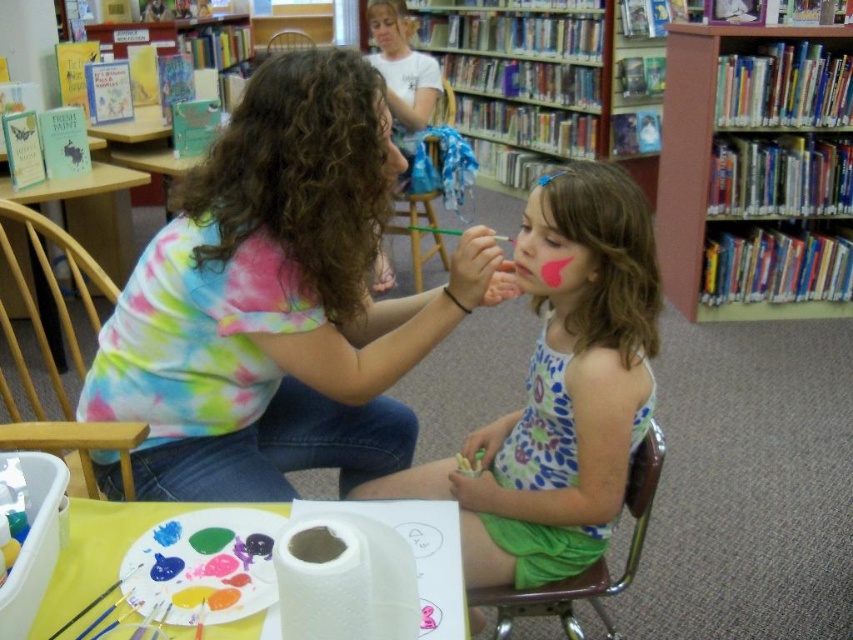
You are standing at the entrance of the library and see the green fabric chair at lower right and the pink matte paint at center. Which object is closer to you?

The green fabric chair at lower right is closer to you because it is further to the viewer than the pink matte paint at center.